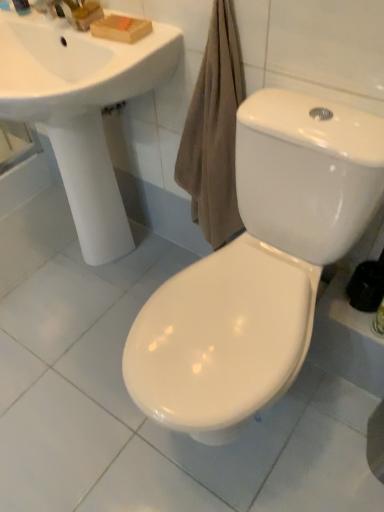
Question: From a real-world perspective, is white glossy sink at upper left on top of white glossy toilet at center?

Choices:
 (A) no
 (B) yes

Answer: (B)

Question: Considering the relative positions of white glossy sink at upper left and white glossy toilet at center in the image provided, is white glossy sink at upper left to the left of white glossy toilet at center from the viewer's perspective?

Choices:
 (A) yes
 (B) no

Answer: (A)

Question: Can you confirm if white glossy sink at upper left is smaller than white glossy toilet at center?

Choices:
 (A) yes
 (B) no

Answer: (A)

Question: Can you confirm if white glossy sink at upper left is bigger than white glossy toilet at center?

Choices:
 (A) no
 (B) yes

Answer: (A)

Question: Is white glossy sink at upper left positioned beyond the bounds of white glossy toilet at center?

Choices:
 (A) yes
 (B) no

Answer: (A)

Question: Based on their sizes in the image, would you say matte plastic soap at upper left is bigger or smaller than white glossy toilet at center?

Choices:
 (A) big
 (B) small

Answer: (B)

Question: From the image's perspective, is matte plastic soap at upper left positioned above or below white glossy toilet at center?

Choices:
 (A) below
 (B) above

Answer: (B)

Question: Is point (13, 4) positioned closer to the camera than point (271, 244)?

Choices:
 (A) closer
 (B) farther

Answer: (B)

Question: Is matte plastic soap at upper left taller or shorter than white glossy toilet at center?

Choices:
 (A) tall
 (B) short

Answer: (B)

Question: Does point (69, 80) appear closer or farther from the camera than point (269, 151)?

Choices:
 (A) closer
 (B) farther

Answer: (B)

Question: Looking at their shapes, would you say white glossy sink at upper left is wider or thinner than white glossy toilet at center?

Choices:
 (A) thin
 (B) wide

Answer: (A)

Question: Would you say white glossy sink at upper left is to the left or to the right of white glossy toilet at center in the picture?

Choices:
 (A) right
 (B) left

Answer: (B)

Question: From a real-world perspective, relative to white glossy toilet at center, is white glossy sink at upper left vertically above or below?

Choices:
 (A) above
 (B) below

Answer: (A)

Question: Considering the positions of white glossy toilet at center and white glossy sink at upper left in the image, is white glossy toilet at center taller or shorter than white glossy sink at upper left?

Choices:
 (A) tall
 (B) short

Answer: (A)

Question: Is white glossy toilet at center in front of or behind white glossy sink at upper left in the image?

Choices:
 (A) behind
 (B) front

Answer: (B)